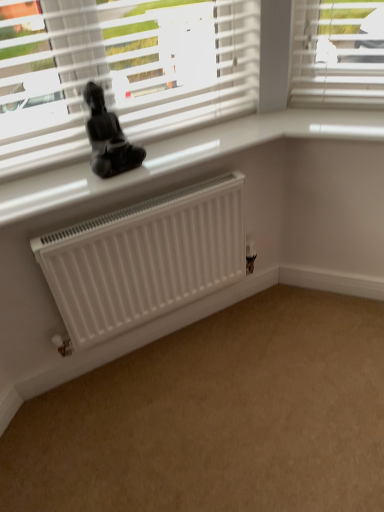
Identify the location of black glossy statue at upper center. (108, 137).

Locate an element on the screen. white matte radiator at lower left is located at coordinates (217, 417).

Where is `black glossy statue at upper center`? This screenshot has width=384, height=512. black glossy statue at upper center is located at coordinates click(x=108, y=137).

Would you say black glossy statue at upper center is outside white matte radiator at center?

Yes.

From a real-world perspective, is black glossy statue at upper center beneath white matte radiator at center?

No, from a real-world perspective, black glossy statue at upper center is not beneath white matte radiator at center.

Are black glossy statue at upper center and white matte radiator at center located far from each other?

No, black glossy statue at upper center is not far away from white matte radiator at center.

Does black glossy statue at upper center have a greater width compared to white matte radiator at center?

No.

Consider the image. Which is correct: white matte radiator at lower left is inside black glossy statue at upper center, or outside of it?

white matte radiator at lower left is located beyond the bounds of black glossy statue at upper center.

This screenshot has width=384, height=512. Identify the location of plain below the black glossy statue at upper center (from a real-world perspective). (217, 417).

Is point (342, 451) closer to camera compared to point (101, 101)?

No.

In terms of height, does white matte radiator at lower left look taller or shorter compared to black glossy statue at upper center?

white matte radiator at lower left is shorter than black glossy statue at upper center.

Between point (88, 247) and point (350, 126), which one is positioned in front?

The point (88, 247) is closer to the camera.

Between white matte radiator at center and white glossy window sill at upper center, which one has larger width?

Wider between the two is white glossy window sill at upper center.

Is white matte radiator at center surrounding white glossy window sill at upper center?

No, white glossy window sill at upper center is not a part of white matte radiator at center.

From a real-world perspective, which object rests below the other?

white glossy window sill at upper center is physically lower.

Can you confirm if white glossy window sill at upper center is taller than black glossy statue at upper center?

No.

How different are the orientations of white glossy window sill at upper center and black glossy statue at upper center in degrees?

The facing directions of white glossy window sill at upper center and black glossy statue at upper center are 2.57 degrees apart.

Which is nearer, [125,157] or [244,368]?

Point [125,157] is positioned closer to the camera compared to point [244,368].

Is black glossy statue at upper center oriented towards white matte radiator at lower left?

No, black glossy statue at upper center is not turned towards white matte radiator at lower left.

I want to click on window sill above the white matte radiator at lower left (from a real-world perspective), so click(x=182, y=157).

Considering the relative sizes of white matte radiator at lower left and white glossy window sill at upper center in the image provided, is white matte radiator at lower left thinner than white glossy window sill at upper center?

In fact, white matte radiator at lower left might be wider than white glossy window sill at upper center.

From a real-world perspective, between white matte radiator at lower left and white glossy window sill at upper center, who is vertically lower?

white matte radiator at lower left is physically lower.

Is white glossy window sill at upper center surrounded by white matte radiator at lower left?

That's incorrect, white glossy window sill at upper center is not inside white matte radiator at lower left.

Is white glossy window sill at upper center wider or thinner than white matte radiator at center?

white glossy window sill at upper center is wider than white matte radiator at center.

Which of these two, white glossy window sill at upper center or white matte radiator at center, is bigger?

white matte radiator at center.

From a real-world perspective, which is physically below, white glossy window sill at upper center or white matte radiator at center?

white matte radiator at center, from a real-world perspective.

Could you tell me if white glossy window sill at upper center is turned towards white matte radiator at center?

No, white glossy window sill at upper center is not turned towards white matte radiator at center.

At what (x,y) coordinates should I click in order to perform the action: click on miniature that is on the left side of white matte radiator at center. Please return your answer as a coordinate pair (x, y). Looking at the image, I should click on 108,137.

What are the coordinates of `miniature above the white matte radiator at lower left (from a real-world perspective)` in the screenshot? It's located at (108, 137).

Looking at the image, which one is located further to white matte radiator at center, white matte radiator at lower left or white glossy window sill at upper center?

Among the two, white matte radiator at lower left is located further to white matte radiator at center.

Looking at the image, which one is located closer to white matte radiator at center, black glossy statue at upper center or white glossy window sill at upper center?

white glossy window sill at upper center lies closer to white matte radiator at center than the other object.

Looking at the image, which one is located closer to black glossy statue at upper center, white matte radiator at lower left or white matte radiator at center?

white matte radiator at center is positioned closer to the anchor black glossy statue at upper center.

Considering their positions, is white glossy window sill at upper center positioned further to white matte radiator at lower left than black glossy statue at upper center?

Based on the image, black glossy statue at upper center appears to be further to white matte radiator at lower left.

Based on their spatial positions, is white matte radiator at center or white glossy window sill at upper center closer to white matte radiator at lower left?

white matte radiator at center.

When comparing their distances from white glossy window sill at upper center, does white matte radiator at lower left or black glossy statue at upper center seem closer?

Based on the image, black glossy statue at upper center appears to be nearer to white glossy window sill at upper center.

Considering their positions, is white glossy window sill at upper center positioned closer to white matte radiator at center than black glossy statue at upper center?

white glossy window sill at upper center is positioned closer to the anchor white matte radiator at center.

Which object lies further to the anchor point white matte radiator at lower left, white matte radiator at center or black glossy statue at upper center?

black glossy statue at upper center lies further to white matte radiator at lower left than the other object.

The width and height of the screenshot is (384, 512). Find the location of `radiator between black glossy statue at upper center and white matte radiator at lower left in the up-down direction`. radiator between black glossy statue at upper center and white matte radiator at lower left in the up-down direction is located at coordinates (145, 259).

Identify the location of window sill between black glossy statue at upper center and white matte radiator at lower left in the vertical direction. Image resolution: width=384 pixels, height=512 pixels. (182, 157).

This screenshot has width=384, height=512. I want to click on window sill that lies between black glossy statue at upper center and white matte radiator at center from top to bottom, so click(x=182, y=157).

Find the location of `radiator between white glossy window sill at upper center and white matte radiator at lower left in the up-down direction`. radiator between white glossy window sill at upper center and white matte radiator at lower left in the up-down direction is located at coordinates (145, 259).